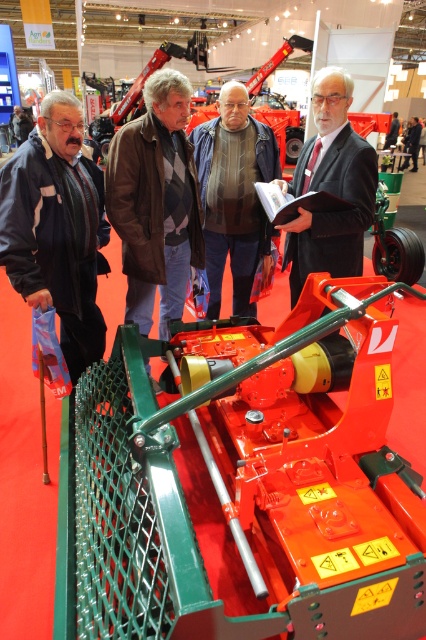
Question: Is brown leather jacket at center positioned behind matte black suit at center?

Choices:
 (A) no
 (B) yes

Answer: (B)

Question: Estimate the real-world distances between objects in this image. Which object is closer to the dark blue jacket at left?

Choices:
 (A) brown leather jacket at center
 (B) brown woolen coat at center

Answer: (B)

Question: Is dark blue jacket at left to the left of matte black suit at center from the viewer's perspective?

Choices:
 (A) no
 (B) yes

Answer: (B)

Question: Is dark blue jacket at left above brown leather jacket at center?

Choices:
 (A) yes
 (B) no

Answer: (B)

Question: Which of the following is the farthest from the observer?

Choices:
 (A) (325, 88)
 (B) (89, 298)

Answer: (B)

Question: Which is farther from the brown leather jacket at center?

Choices:
 (A) matte black suit at center
 (B) brown woolen coat at center

Answer: (A)